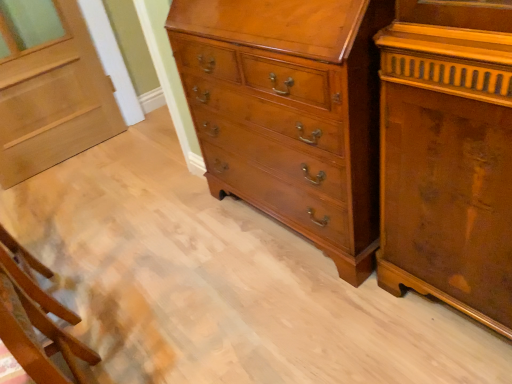
Question: Do you think wooden chair at lower left is within glossy wood chest of drawers at center, or outside of it?

Choices:
 (A) inside
 (B) outside

Answer: (B)

Question: Is wooden chair at lower left bigger or smaller than glossy wood chest of drawers at center?

Choices:
 (A) big
 (B) small

Answer: (B)

Question: Which of these objects is positioned farthest from the light brown wood door at upper left?

Choices:
 (A) glossy wood chest of drawers at center
 (B) wooden chair at lower left

Answer: (A)

Question: Which object is positioned farthest from the glossy wood chest of drawers at center?

Choices:
 (A) light brown wood door at upper left
 (B) wooden chair at lower left

Answer: (A)